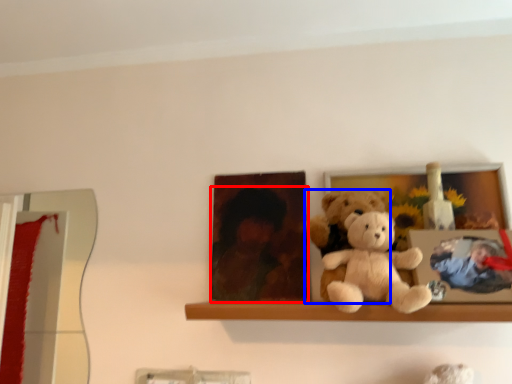
Question: Which of the following is the closest to the observer, person (highlighted by a red box) or teddy bear (highlighted by a blue box)?

Choices:
 (A) person
 (B) teddy bear

Answer: (B)